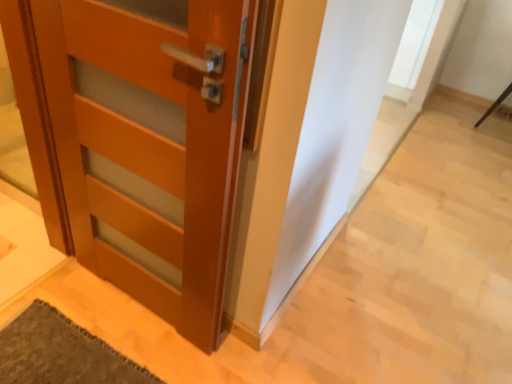
The image size is (512, 384). What are the coordinates of `free point in front of matte wood door at left` in the screenshot? It's located at (123, 348).